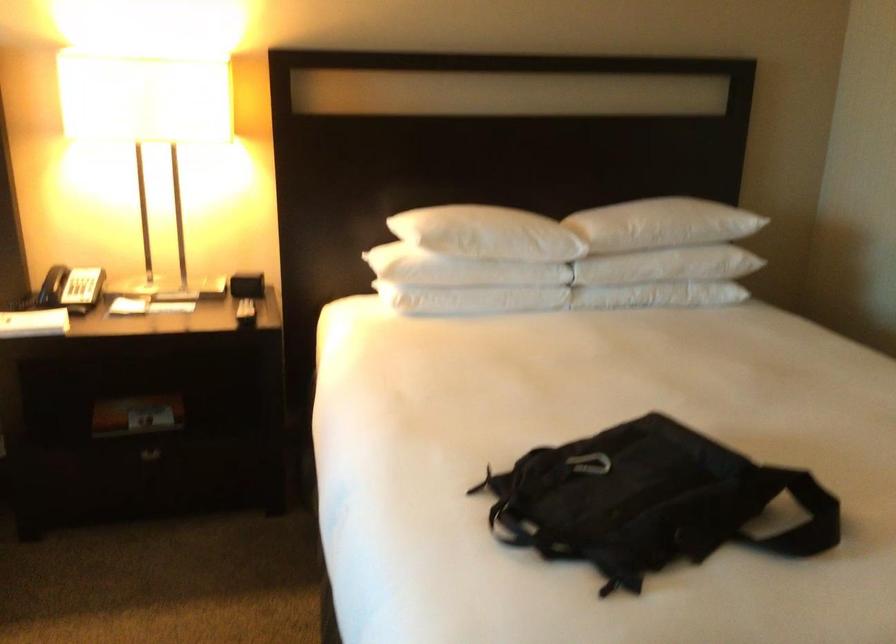
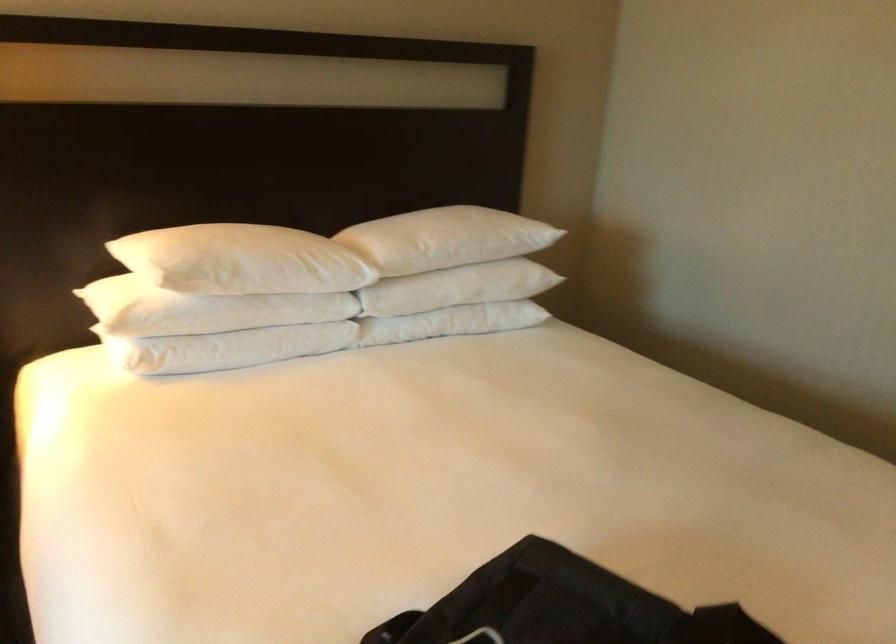
Question: The images are taken continuously from a first-person perspective. In which direction are you moving?

Choices:
 (A) Left
 (B) Right
 (C) Forward
 (D) Backward

Answer: (C)